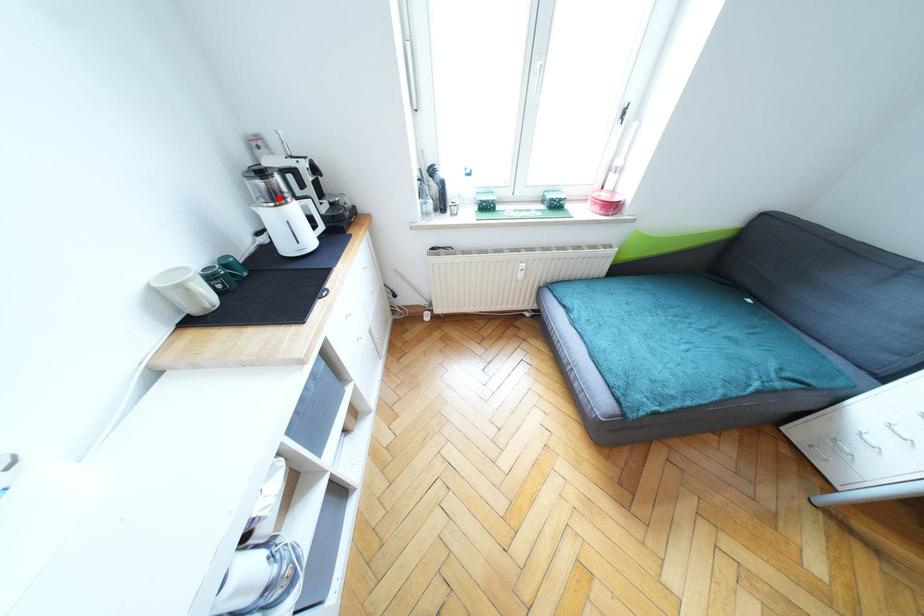
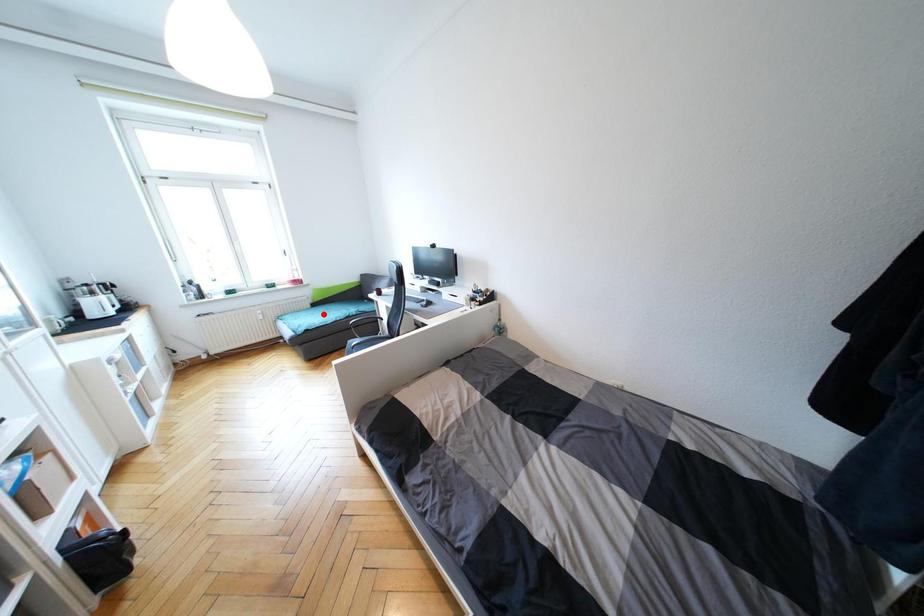
I am providing you with two images of the same scene from different viewpoints. A red point is marked on the first image and another point is marked on the second image. Are the points marked in image1 and image2 representing the same 3D position?

No